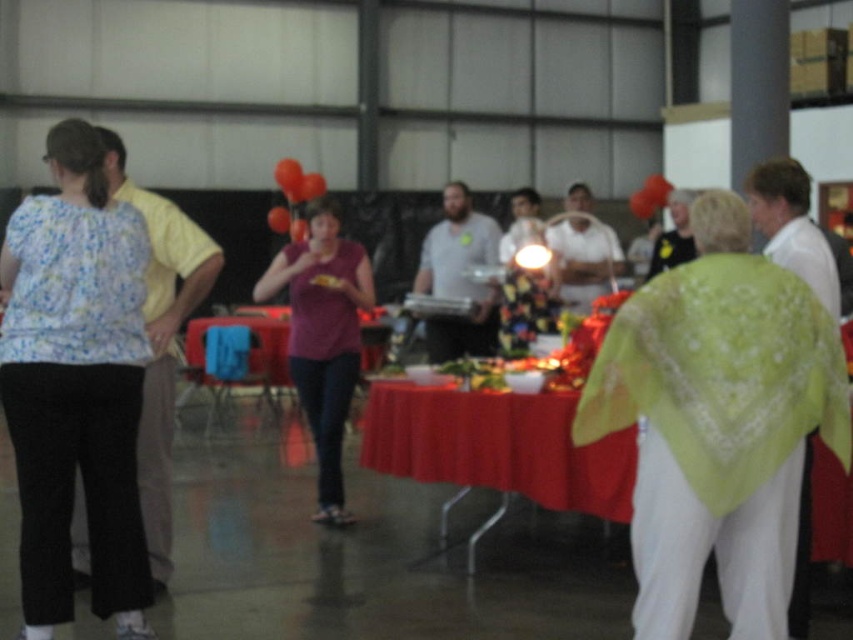
Does floral fabric blouse at left come behind red fabric table at center?

No, floral fabric blouse at left is in front of red fabric table at center.

From the picture: Between floral fabric blouse at left and red fabric table at center, which one has less height?

With less height is red fabric table at center.

Locate an element on the screen. This screenshot has height=640, width=853. floral fabric blouse at left is located at coordinates (76, 385).

What are the coordinates of `floral fabric blouse at left` in the screenshot? It's located at (76, 385).

Can you confirm if rubber orange balloon at upper center is smaller than red rubber balloon at center?

No.

Does rubber orange balloon at upper center have a larger size compared to red rubber balloon at center?

Indeed, rubber orange balloon at upper center has a larger size compared to red rubber balloon at center.

Measure the distance between rubber orange balloon at upper center and camera.

rubber orange balloon at upper center and camera are 11.66 meters apart.

I want to click on rubber orange balloon at upper center, so click(288, 173).

Is purple matte shirt at center shorter than red rubber balloon at center?

No, purple matte shirt at center is not shorter than red rubber balloon at center.

Does purple matte shirt at center appear on the left side of red rubber balloon at center?

In fact, purple matte shirt at center is to the right of red rubber balloon at center.

This screenshot has width=853, height=640. What do you see at coordinates (323, 337) in the screenshot?
I see `purple matte shirt at center` at bounding box center [323, 337].

At what (x,y) coordinates should I click in order to perform the action: click on purple matte shirt at center. Please return your answer as a coordinate pair (x, y). This screenshot has height=640, width=853. Looking at the image, I should click on (323, 337).